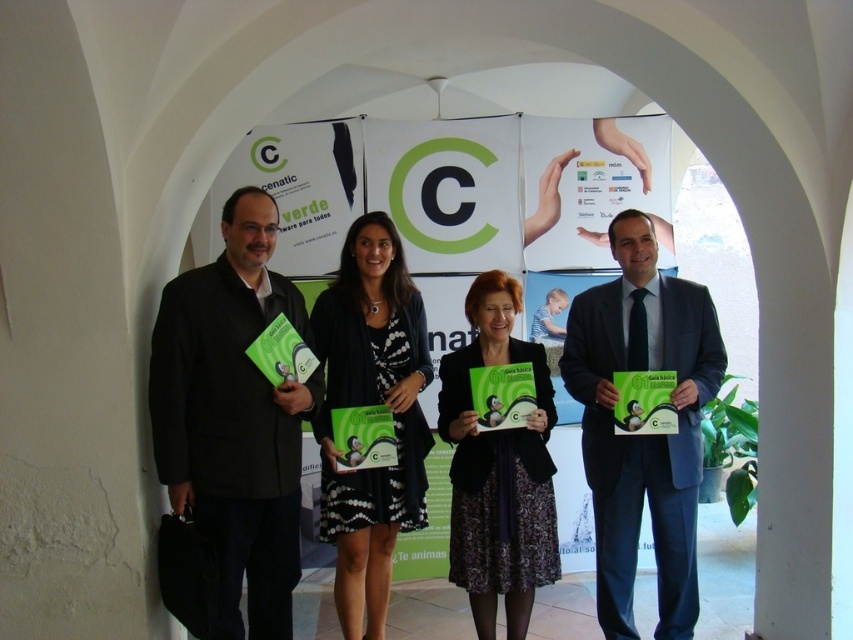
Question: Which object appears closest to the camera in this image?

Choices:
 (A) matte black suit at left
 (B) black dotted dress at center
 (C) matte black jacket at center

Answer: (A)

Question: Considering the relative positions of matte black suit at center and matte black jacket at center in the image provided, where is matte black suit at center located with respect to matte black jacket at center?

Choices:
 (A) above
 (B) below

Answer: (A)

Question: Does matte black suit at left appear over black dotted dress at center?

Choices:
 (A) no
 (B) yes

Answer: (B)

Question: Is black dotted dress at center to the right of matte black jacket at center from the viewer's perspective?

Choices:
 (A) no
 (B) yes

Answer: (A)

Question: Which object is the closest to the matte black suit at center?

Choices:
 (A) matte black suit at left
 (B) matte black jacket at center
 (C) black dotted dress at center

Answer: (B)

Question: Which is nearer to the matte black suit at center?

Choices:
 (A) black dotted dress at center
 (B) matte black suit at left
 (C) matte black jacket at center

Answer: (C)